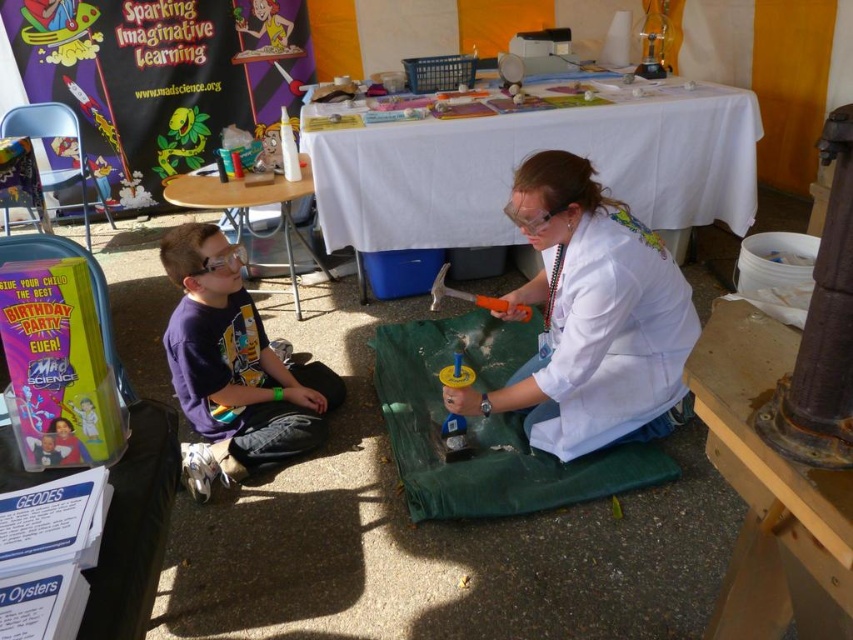
Question: Is white cloth-covered table at center to the left of rustic wood table at center from the viewer's perspective?

Choices:
 (A) yes
 (B) no

Answer: (A)

Question: Which of the following is the closest to the observer?

Choices:
 (A) (610, 84)
 (B) (293, 442)

Answer: (B)

Question: Is wooden folding table at center to the left of translucent plastic toy at center from the viewer's perspective?

Choices:
 (A) yes
 (B) no

Answer: (A)

Question: Can you confirm if rustic wood table at center is positioned above translucent plastic toy at center?

Choices:
 (A) yes
 (B) no

Answer: (B)

Question: Based on their relative distances, which object is nearer to the white paper at lower left?

Choices:
 (A) rustic wood table at center
 (B) purple cotton shirt at lower left
 (C) wooden folding table at center
 (D) white cloth-covered table at center

Answer: (A)

Question: Which of the following is the closest to the observer?

Choices:
 (A) (514, 189)
 (B) (816, 518)
 (C) (312, 259)

Answer: (B)